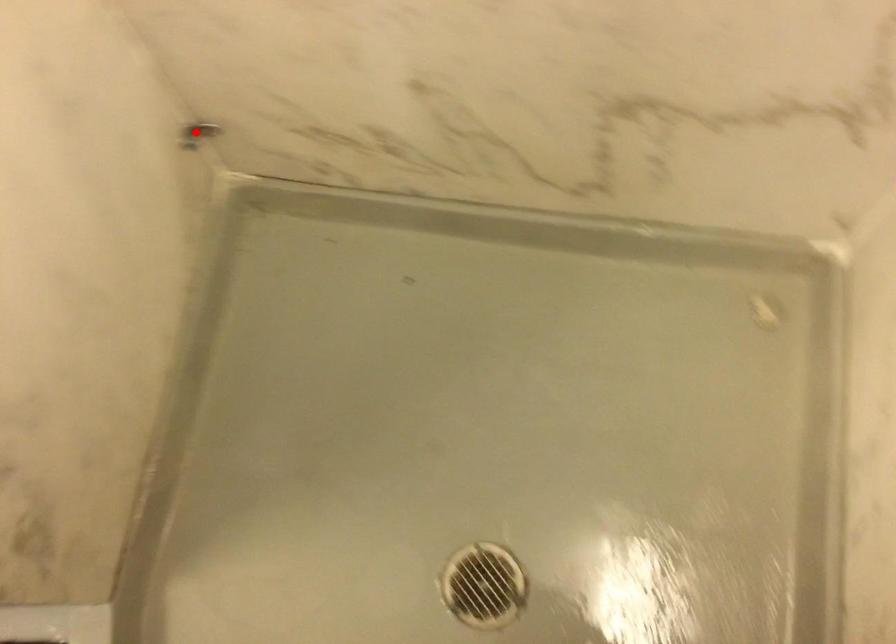
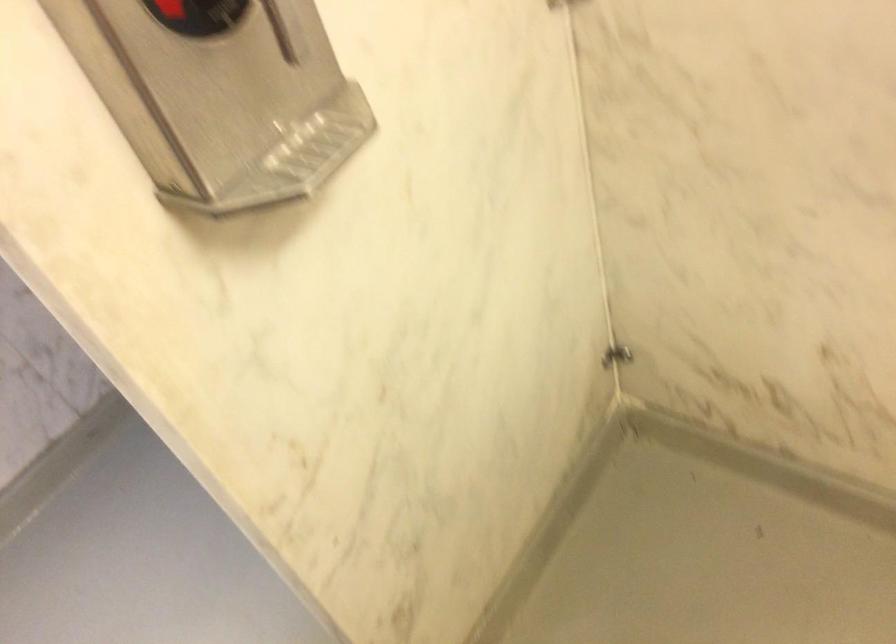
Locate, in the second image, the point that corresponds to the highlighted location in the first image.

(616, 355)